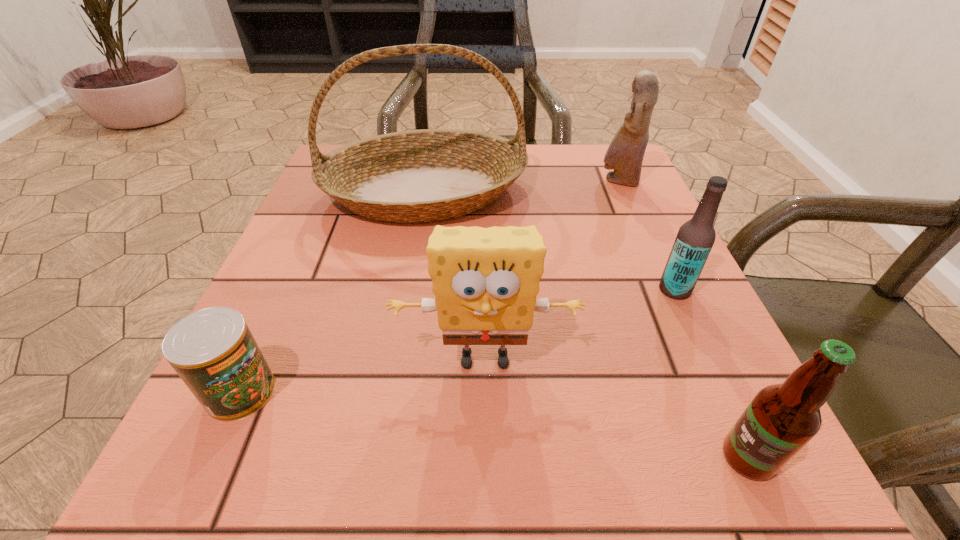
You are a GUI agent. You are given a task and a screenshot of the screen. Output one action in this format:
    pyautogui.click(x=<x>, y=<y>)
    Task: Click on the tallest object
    The height and width of the screenshot is (540, 960).
    Given the screenshot: What is the action you would take?
    click(425, 175)

Identify the location of figurine. The width and height of the screenshot is (960, 540). (625, 154).

Locate an element on the screen. Image resolution: width=960 pixels, height=540 pixels. sponge is located at coordinates (485, 280).

Identify the location of the fourth nearest object. This screenshot has height=540, width=960. (695, 238).

Locate an element on the screen. This screenshot has width=960, height=540. the nearer beer bottle is located at coordinates (782, 418).

At what (x,y) coordinates should I click in order to perform the action: click on the shortest object. Please return your answer as a coordinate pair (x, y). Looking at the image, I should click on (213, 351).

The image size is (960, 540). I want to click on free space located 0.350m on the front of the tallest object, so click(x=391, y=398).

In order to click on vacant space positioned on the front-facing side of the figurine in this screenshot , I will do pos(434,181).

Where is `free space located on the front-facing side of the figurine`? free space located on the front-facing side of the figurine is located at coordinates (540, 181).

In order to click on vacant space situated on the front-facing side of the figurine in this screenshot , I will do `click(456, 181)`.